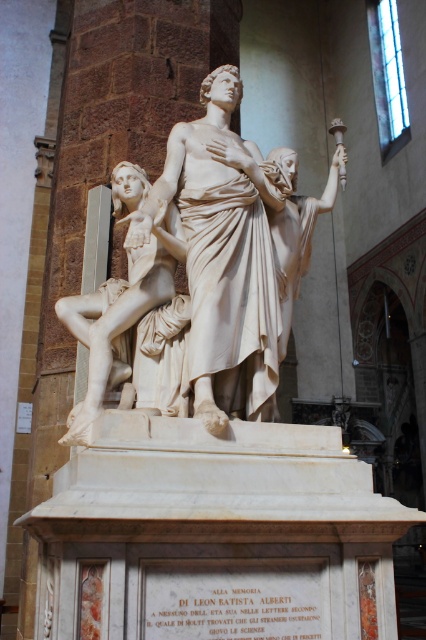
Is white marble statue at center below white marble statue at left?

Correct, white marble statue at center is located below white marble statue at left.

Is white marble statue at center positioned before white marble statue at left?

Yes, it is.

Is point (210, 259) closer to camera compared to point (112, 317)?

Yes, point (210, 259) is in front of point (112, 317).

Locate an element on the screen. white marble statue at center is located at coordinates (224, 256).